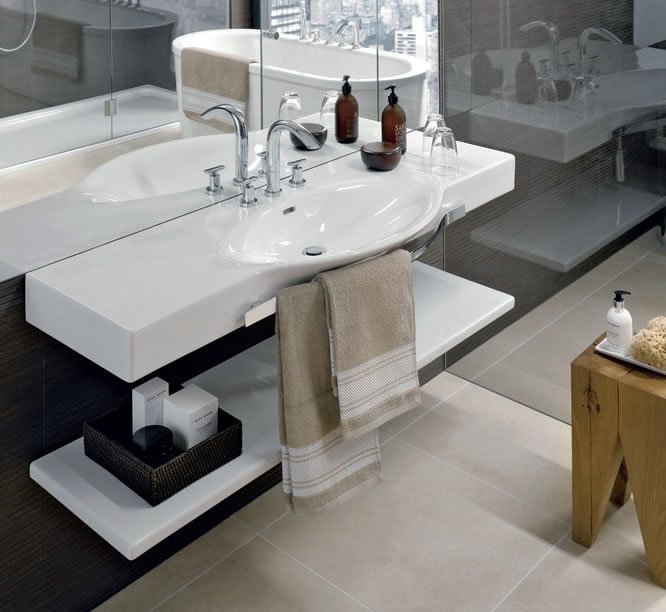
You are a GUI agent. You are given a task and a screenshot of the screen. Output one action in this format:
    pyautogui.click(x=<x>, y=<y>)
    Task: Click on the brown towel
    
    Given the screenshot: What is the action you would take?
    pyautogui.click(x=316, y=424)